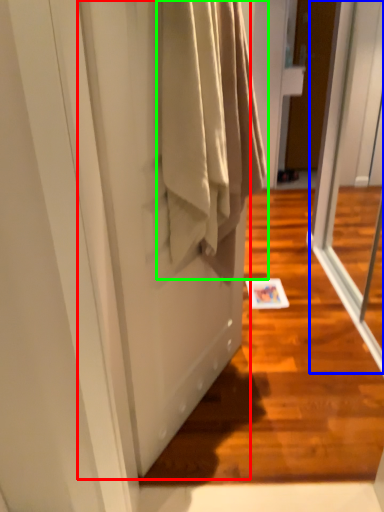
Question: Which object is positioned closest to screen door (highlighted by a red box)? Select from screen door (highlighted by a blue box) and clothing (highlighted by a green box).

Choices:
 (A) screen door
 (B) clothing

Answer: (B)